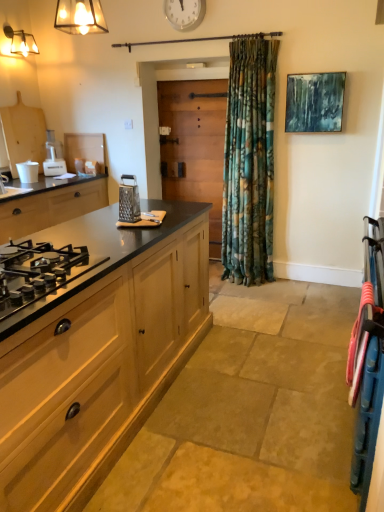
This screenshot has width=384, height=512. Identify the location of free space to the right of white matte cup at left, placed as the first appliance when sorted from bottom to top. (46, 184).